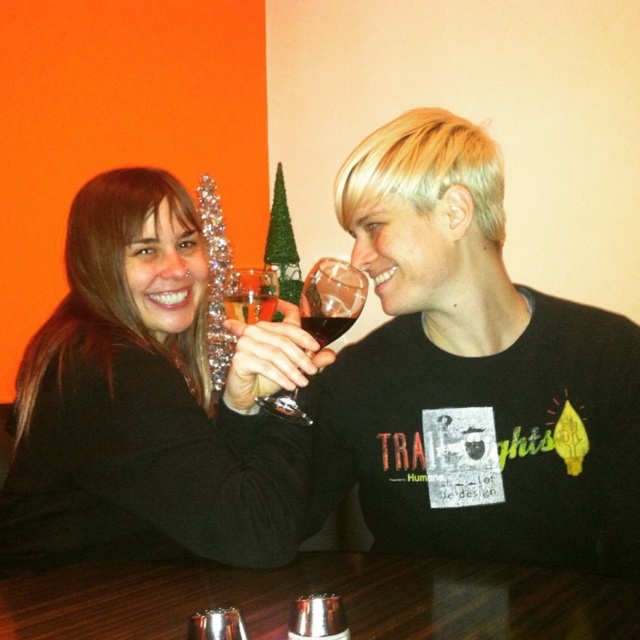
Question: Does matte black shirt at center have a larger size compared to transparent glass wine glass at center?

Choices:
 (A) no
 (B) yes

Answer: (B)

Question: Based on their relative distances, which object is nearer to the wooden table at center?

Choices:
 (A) matte black wine glass at upper left
 (B) translucent glass wine at center

Answer: (A)

Question: Among these points, which one is farthest from the camera?

Choices:
 (A) (326, 282)
 (B) (125, 243)
 (C) (497, 604)

Answer: (B)

Question: Considering the relative positions of matte black shirt at center and translucent glass wine at center in the image provided, where is matte black shirt at center located with respect to translucent glass wine at center?

Choices:
 (A) left
 (B) right

Answer: (B)

Question: Where is transparent glass wine glass at center located in relation to translucent glass wine at center in the image?

Choices:
 (A) above
 (B) below

Answer: (A)

Question: Which point is farther from the camera taking this photo?

Choices:
 (A) (336, 577)
 (B) (273, 449)
 (C) (312, 323)
 (D) (326, 269)

Answer: (D)